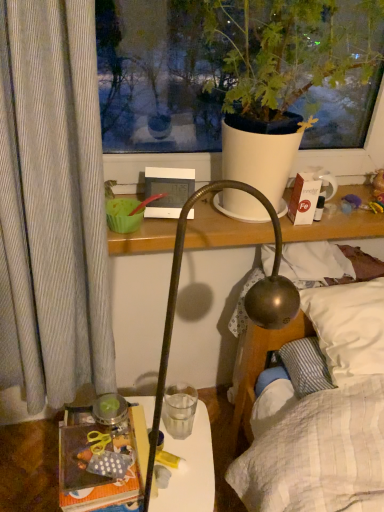
Question: Is white cardboard box at upper right wider than translucent plastic table at lower left?

Choices:
 (A) no
 (B) yes

Answer: (A)

Question: Could you tell me if white cardboard box at upper right is turned towards translucent plastic table at lower left?

Choices:
 (A) yes
 (B) no

Answer: (B)

Question: Is white cardboard box at upper right facing away from translucent plastic table at lower left?

Choices:
 (A) yes
 (B) no

Answer: (B)

Question: Does white cardboard box at upper right have a lesser width compared to translucent plastic table at lower left?

Choices:
 (A) yes
 (B) no

Answer: (A)

Question: Is white cardboard box at upper right smaller than translucent plastic table at lower left?

Choices:
 (A) yes
 (B) no

Answer: (A)

Question: From a real-world perspective, is white matte pot at upper center above or below translucent plastic table at lower left?

Choices:
 (A) below
 (B) above

Answer: (B)

Question: Relative to translucent plastic table at lower left, is white matte pot at upper center in front or behind?

Choices:
 (A) behind
 (B) front

Answer: (B)

Question: From the image's perspective, is white matte pot at upper center above or below translucent plastic table at lower left?

Choices:
 (A) above
 (B) below

Answer: (A)

Question: Is point (332, 31) positioned closer to the camera than point (187, 453)?

Choices:
 (A) farther
 (B) closer

Answer: (B)

Question: Is white matte pot at upper center taller or shorter than white soft pillow at upper right?

Choices:
 (A) short
 (B) tall

Answer: (B)

Question: From the image's perspective, is white matte pot at upper center above or below white soft pillow at upper right?

Choices:
 (A) below
 (B) above

Answer: (B)

Question: From a real-world perspective, is white matte pot at upper center physically located above or below white soft pillow at upper right?

Choices:
 (A) above
 (B) below

Answer: (A)

Question: Looking at their shapes, would you say white matte pot at upper center is wider or thinner than white soft pillow at upper right?

Choices:
 (A) wide
 (B) thin

Answer: (A)

Question: Looking at the image, does transparent glass at center seem bigger or smaller compared to polka dot fabric book at lower left?

Choices:
 (A) big
 (B) small

Answer: (B)

Question: Is transparent glass at center inside or outside of polka dot fabric book at lower left?

Choices:
 (A) inside
 (B) outside

Answer: (B)